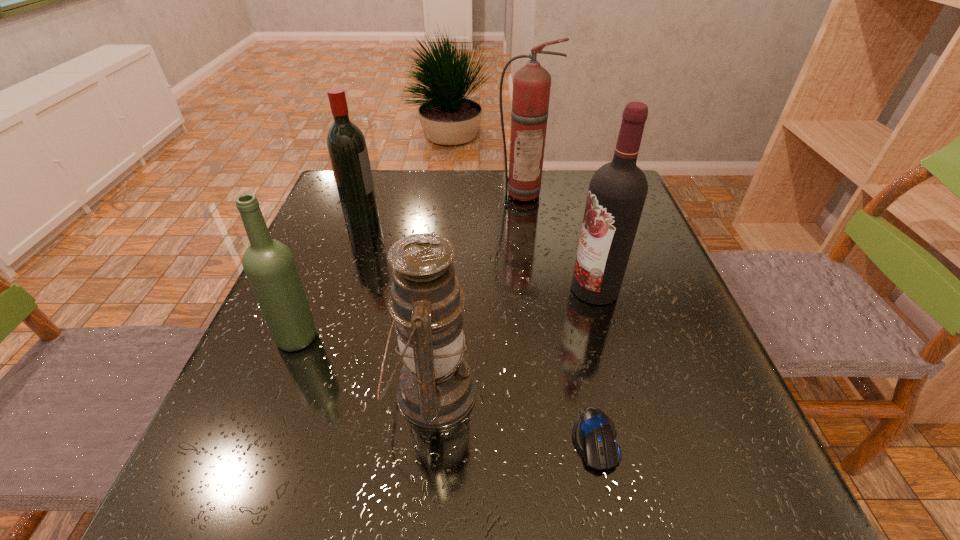
Where is `vacant space that satisfies the following two spatial constraints: 1. on the label of the third object from left to right; 2. on the left side of the farthest wine bottle`? vacant space that satisfies the following two spatial constraints: 1. on the label of the third object from left to right; 2. on the left side of the farthest wine bottle is located at coordinates (302, 392).